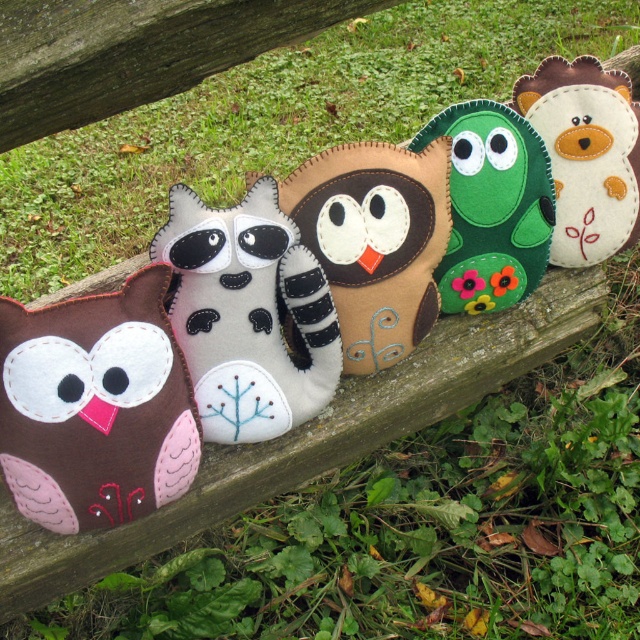
Question: Does brown felt/soft toy at lower left appear under brown felt/soft toy at center?

Choices:
 (A) no
 (B) yes

Answer: (B)

Question: Which of these objects is positioned farthest from the felt/soft toy at center?

Choices:
 (A) felt bear at upper right
 (B) green felt/soft toy at center
 (C) brown felt/soft toy at center

Answer: (A)

Question: Which is nearer to the brown felt/soft toy at center?

Choices:
 (A) felt bear at upper right
 (B) brown felt/soft toy at lower left
 (C) felt/soft toy at center

Answer: (C)

Question: Considering the relative positions of brown felt/soft toy at lower left and brown felt/soft toy at center in the image provided, where is brown felt/soft toy at lower left located with respect to brown felt/soft toy at center?

Choices:
 (A) below
 (B) above

Answer: (A)

Question: Is felt/soft toy at center in front of green felt/soft toy at center?

Choices:
 (A) no
 (B) yes

Answer: (B)

Question: Which point is closer to the camera?

Choices:
 (A) (104, 422)
 (B) (538, 67)

Answer: (A)